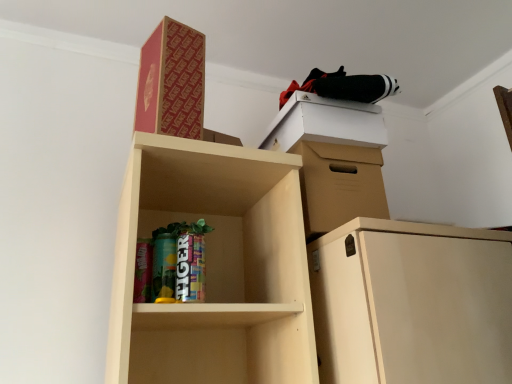
Question: Does point (157, 89) appear closer or farther from the camera than point (358, 107)?

Choices:
 (A) farther
 (B) closer

Answer: (B)

Question: From the image's perspective, is red cardboard box at upper center above or below white cardboard box at upper right?

Choices:
 (A) below
 (B) above

Answer: (B)

Question: Considering the positions of red cardboard box at upper center and white cardboard box at upper right in the image, is red cardboard box at upper center wider or thinner than white cardboard box at upper right?

Choices:
 (A) thin
 (B) wide

Answer: (A)

Question: Based on their sizes in the image, would you say white cardboard box at upper right is bigger or smaller than red cardboard box at upper center?

Choices:
 (A) big
 (B) small

Answer: (A)

Question: From the image's perspective, relative to red cardboard box at upper center, is white cardboard box at upper right above or below?

Choices:
 (A) below
 (B) above

Answer: (A)

Question: In terms of width, does white cardboard box at upper right look wider or thinner when compared to red cardboard box at upper center?

Choices:
 (A) wide
 (B) thin

Answer: (A)

Question: In terms of height, does white cardboard box at upper right look taller or shorter compared to red cardboard box at upper center?

Choices:
 (A) short
 (B) tall

Answer: (A)